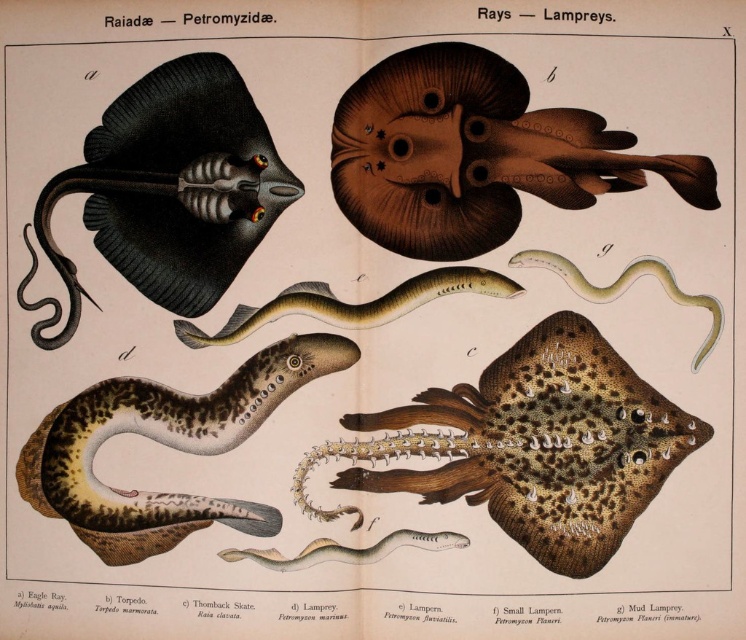
From the picture: You are standing 5 feet away from the image. Is the point at coordinates point (554, 381) closer to you than the image itself?

The distance of point (554, 381) from viewer is 4.02 feet, so yes, the point at coordinates point (554, 381) is closer to you than the image itself since it is 4.02 feet away while you are standing 5 feet away from the image.

Which species is located at the point with coordinates (x=474, y=154)?

The point with coordinates (x=474, y=154) is on the brown matte ray at upper center.